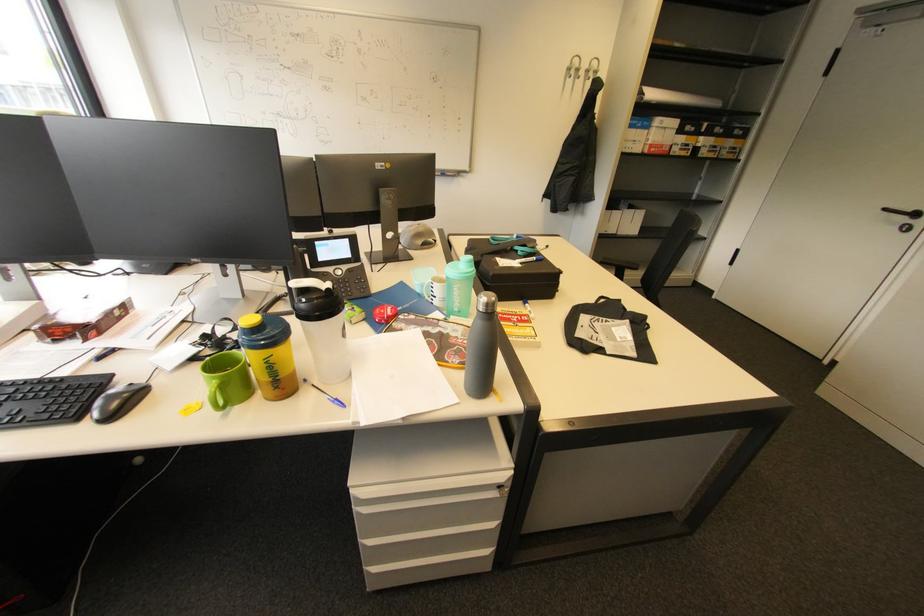
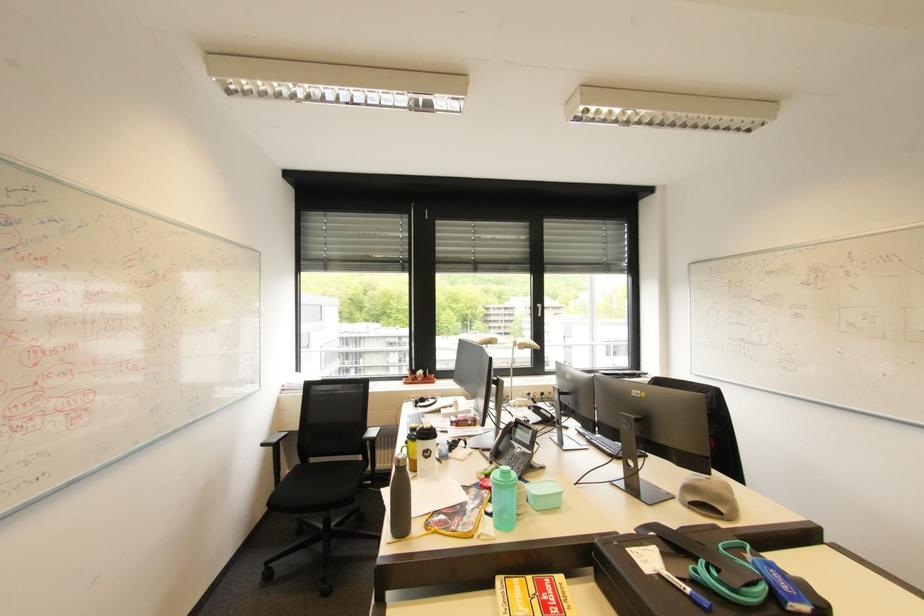
Find the pixel in the second image that matches (x=527, y=331) in the first image.

(526, 602)